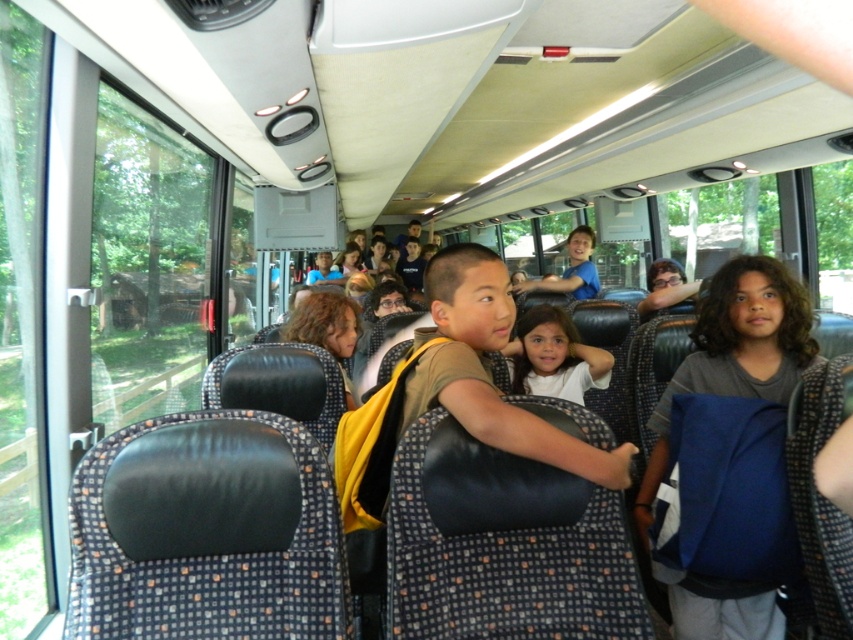
Question: Can you confirm if gray cotton shirt at right is positioned to the left of white matte shirt at center?

Choices:
 (A) no
 (B) yes

Answer: (A)

Question: Is gray cotton shirt at right to the right of white matte shirt at center from the viewer's perspective?

Choices:
 (A) yes
 (B) no

Answer: (A)

Question: Among these points, which one is farthest from the camera?

Choices:
 (A) (712, 580)
 (B) (610, 365)

Answer: (B)

Question: Is gray cotton shirt at right behind white matte shirt at center?

Choices:
 (A) yes
 (B) no

Answer: (B)